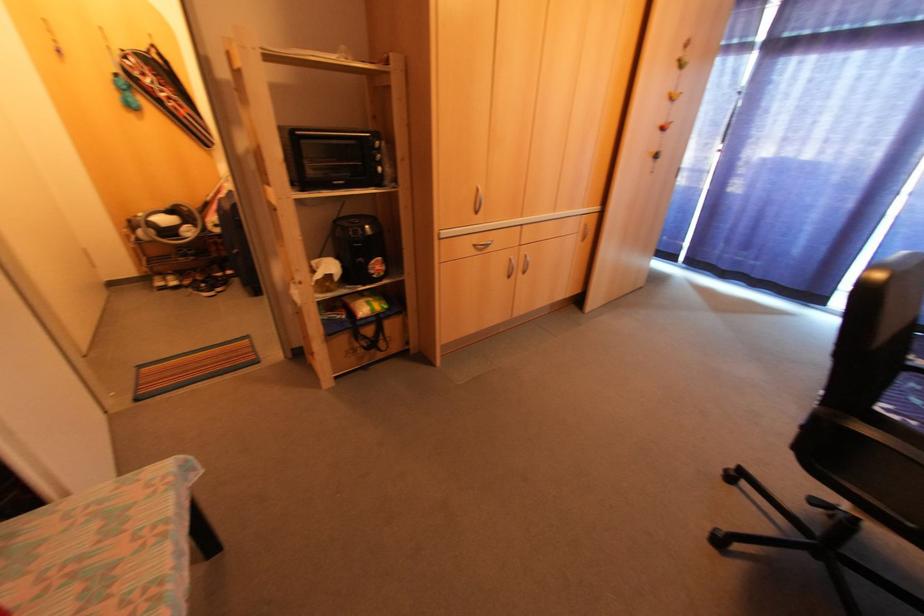
What do you see at coordinates (481, 246) in the screenshot?
I see `the silver drawer handle` at bounding box center [481, 246].